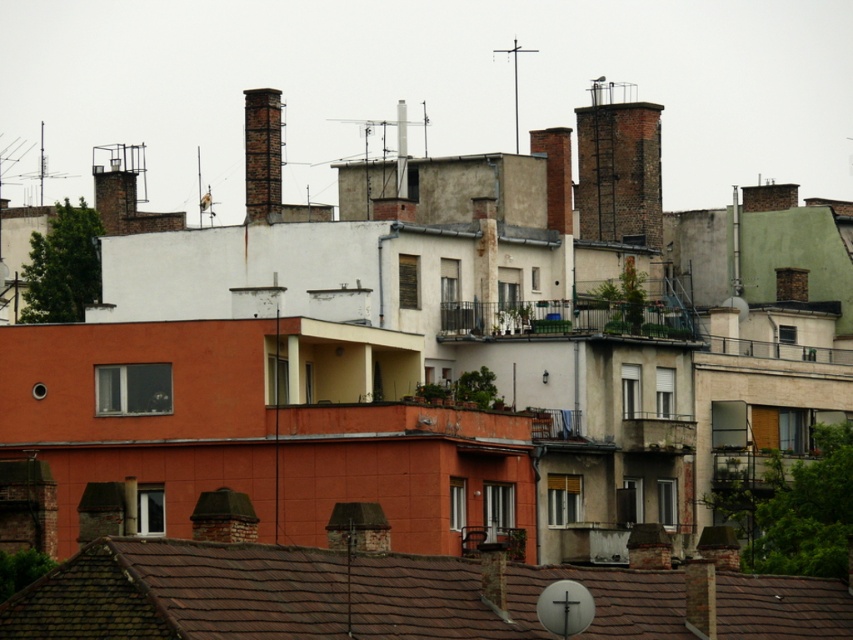
Does point (119, 609) lie in front of point (271, 163)?

Yes, point (119, 609) is closer to viewer.

Does brown tile roof at lower center appear on the left side of brick chimney at upper center?

No, brown tile roof at lower center is not to the left of brick chimney at upper center.

Does point (469, 596) come closer to viewer compared to point (277, 97)?

Yes, point (469, 596) is in front of point (277, 97).

At what (x,y) coordinates should I click in order to perform the action: click on brown tile roof at lower center. Please return your answer as a coordinate pair (x, y). This screenshot has width=853, height=640. Looking at the image, I should click on (x=390, y=596).